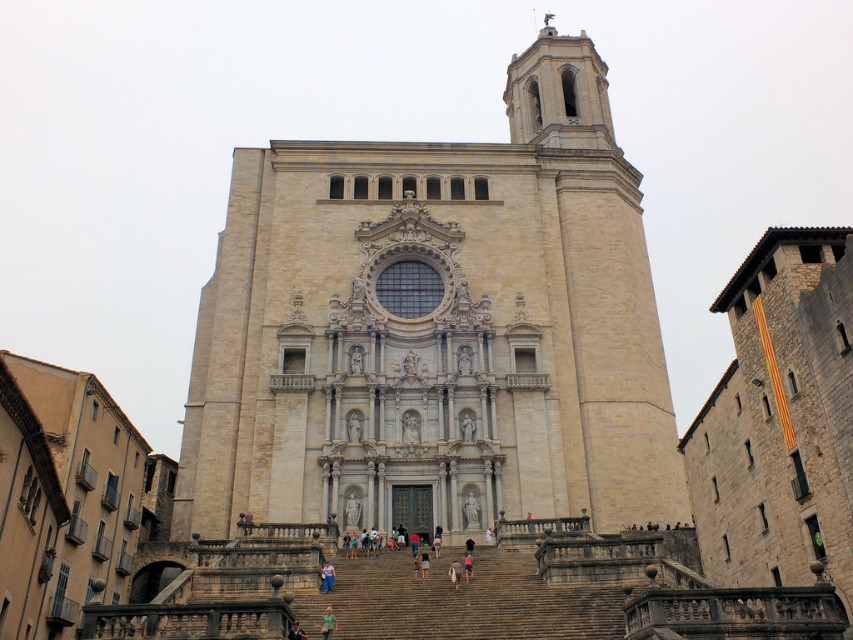
You are standing in front of the historic church described. You notice the beige stone tower at center and the blue denim jeans at center. Which object is positioned to the right of the other?

The beige stone tower at center is to the right of blue denim jeans at center according to the description.

You are standing in front of the grand church and see the blue denim jeans at center and the green fabric shirt at center. Which clothing item is located lower in the scene?

The blue denim jeans at center is positioned under the green fabric shirt at center, so it is located lower in the scene.

Looking at this image, you are a fashion designer observing a model wearing the blue denim jeans at center and the green fabric shirt at center. Which clothing item is wider?

The blue denim jeans at center is wider than the green fabric shirt at center.